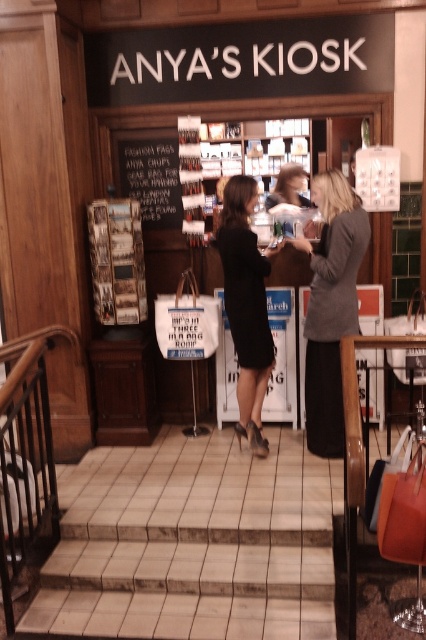
You are a customer at ANYA S KIOSK and you want to buy a gift for your friend. The gift needs to be small enough to fit in your bag. Which item between the black satin dress at center and the black chalkboard at center would you choose?

The black chalkboard at center is smaller in size than the black satin dress at center, so you should choose the black chalkboard at center to fit in your bag.

What is the exact 2D coordinate of the black satin dress at center in the image?

The exact 2D coordinate of the black satin dress at center is at point (247, 305).

You are a customer at ANYA S KIOSK and you want to pick up the gray wool sweater at center and check the price of the black chalkboard at center. Can you reach both items without moving from your current position?

The gray wool sweater at center and the black chalkboard at center are 4.46 feet apart. Since the distance between them is more than arm s length, you cannot reach both items without moving from your current position.